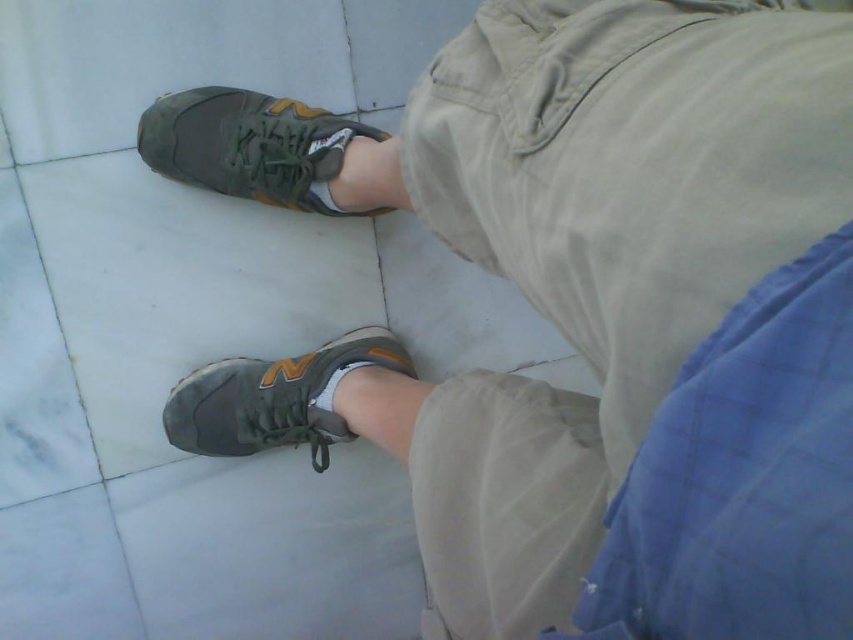
Question: Which point appears closest to the camera in this image?

Choices:
 (A) (239, 452)
 (B) (350, 365)
 (C) (248, 132)

Answer: (C)

Question: Estimate the real-world distances between objects in this image. Which object is closer to the olive-green fabric shoe at center?

Choices:
 (A) matte gray shoe at lower center
 (B) matte gray running shoe at lower center

Answer: (B)

Question: Is olive-green fabric shoe at center wider than matte gray shoe at lower center?

Choices:
 (A) yes
 (B) no

Answer: (A)

Question: Considering the relative positions of olive-green fabric shoe at center and matte gray shoe at lower center in the image provided, where is olive-green fabric shoe at center located with respect to matte gray shoe at lower center?

Choices:
 (A) above
 (B) below

Answer: (A)

Question: Which of the following is the closest to the observer?

Choices:
 (A) (250, 362)
 (B) (328, 164)

Answer: (B)

Question: Is the position of matte gray running shoe at lower center more distant than that of matte gray shoe at lower center?

Choices:
 (A) no
 (B) yes

Answer: (A)